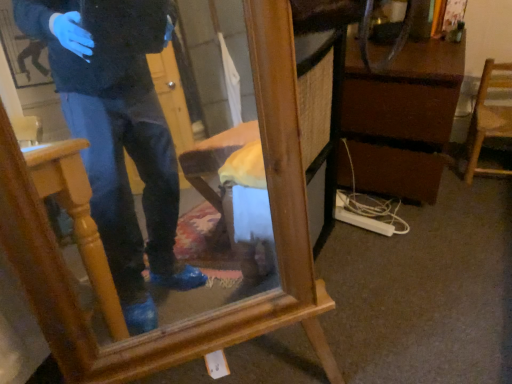
Identify the location of free spot below wooden chair at right (from a real-world perspective). The width and height of the screenshot is (512, 384). (494, 170).